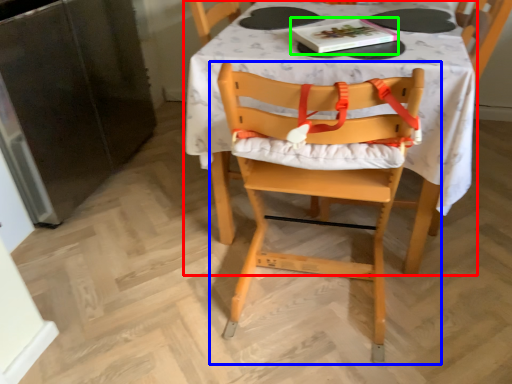
Question: Considering the real-world distances, which object is closest to table (highlighted by a red box)? chair (highlighted by a blue box) or book (highlighted by a green box).

Choices:
 (A) chair
 (B) book

Answer: (A)